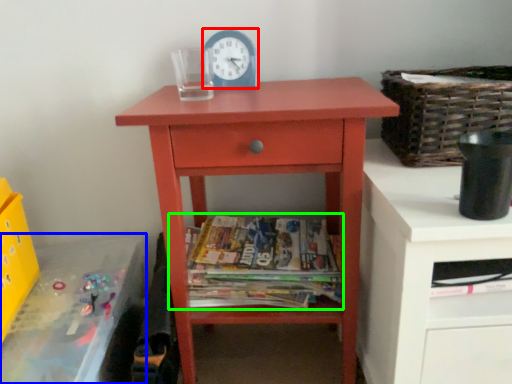
Question: Estimate the real-world distances between objects in this image. Which object is closer to clock (highlighted by a red box), changing table (highlighted by a blue box) or magazine (highlighted by a green box)?

Choices:
 (A) changing table
 (B) magazine

Answer: (B)